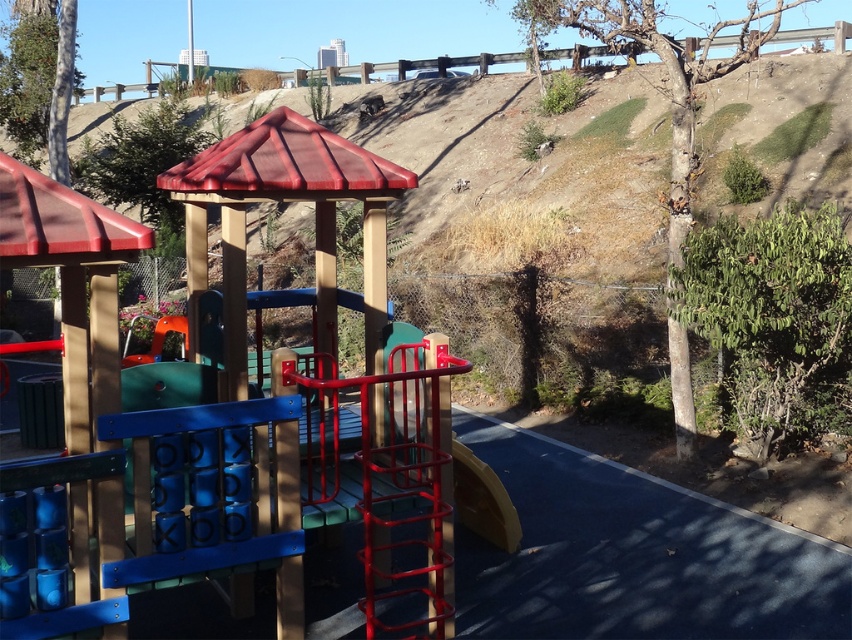
Question: Which point appears closest to the camera in this image?

Choices:
 (A) (494, 484)
 (B) (447, 556)

Answer: (B)

Question: Is wooden playground structure at center closer to the viewer compared to smooth plastic slide at center?

Choices:
 (A) no
 (B) yes

Answer: (B)

Question: Does wooden playground structure at center have a greater width compared to smooth plastic slide at center?

Choices:
 (A) no
 (B) yes

Answer: (B)

Question: Which of the following is the closest to the observer?

Choices:
 (A) (229, 561)
 (B) (455, 481)

Answer: (A)

Question: Is wooden playground structure at center positioned in front of smooth plastic slide at center?

Choices:
 (A) no
 (B) yes

Answer: (B)

Question: Which point appears farthest from the camera in this image?

Choices:
 (A) (498, 497)
 (B) (381, 465)

Answer: (A)